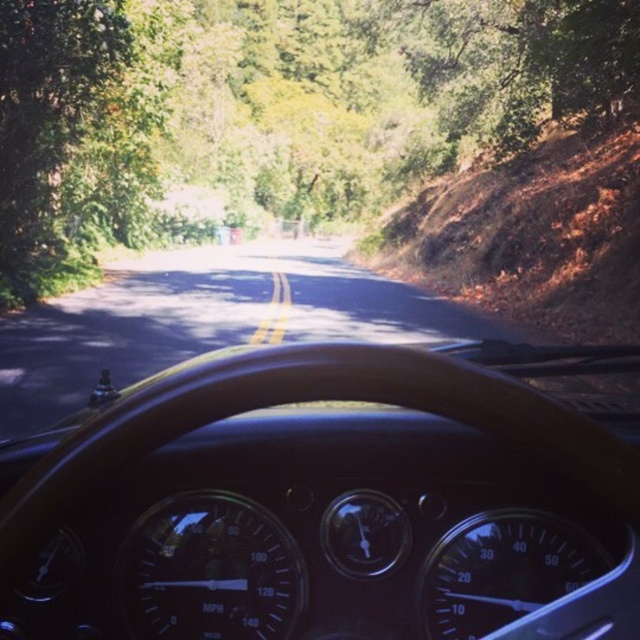
You are sitting in the driver seat of the vehicle and looking at the dashboard. There are two points marked on the dashboard. One is at point (x=472, y=134) and the other is at point (x=28, y=332). Which point is closer to your eyes?

Point (x=28, y=332) is closer to your eyes because it is less further to the camera than point (x=472, y=134).

You are driving a car with a trunk length of 10 feet. You see a green leafy tree at center and an asphalt road at center. Can you safely park your car between them without hitting either?

The distance between the green leafy tree at center and asphalt road at center is 29.61 feet. Since your car trunk is only 10 feet long, there is enough space to park between them safely.